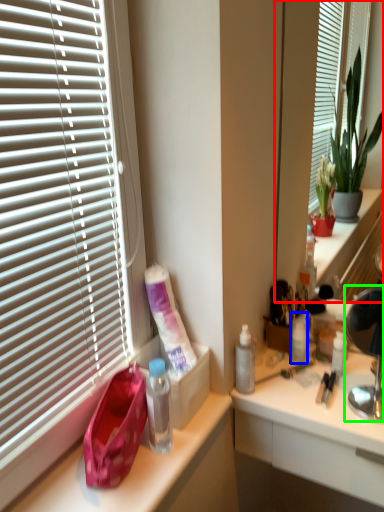
Question: Considering the real-world distances, which object is farthest from mirror (highlighted by a red box)? toiletry (highlighted by a blue box) or lamp (highlighted by a green box)?

Choices:
 (A) toiletry
 (B) lamp

Answer: (B)